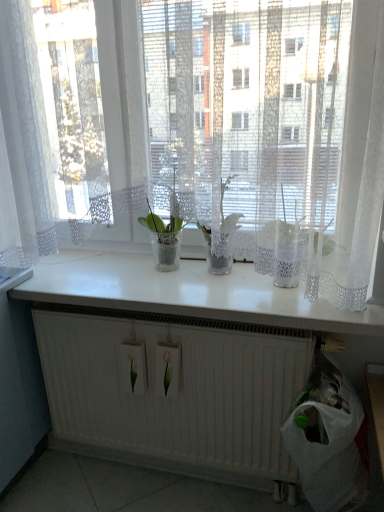
Image resolution: width=384 pixels, height=512 pixels. Identify the location of free spot in front of translucent glass vase at center. (223, 293).